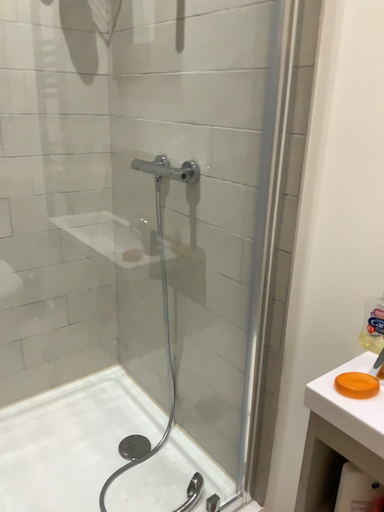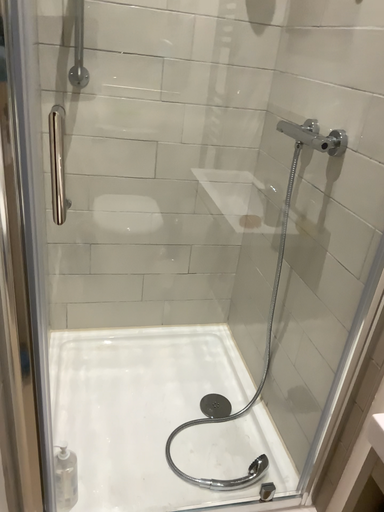
Question: How did the camera likely rotate when shooting the video?

Choices:
 (A) rotated right
 (B) rotated left

Answer: (B)